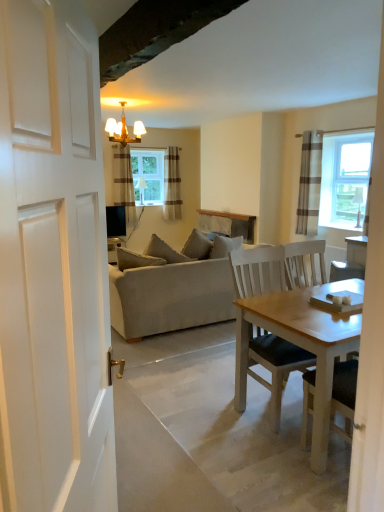
Question: From the image's perspective, would you say gold metallic chandelier at upper center is positioned over striped fabric curtain at center, marked as the 2th curtain in a back-to-front arrangement?

Choices:
 (A) no
 (B) yes

Answer: (B)

Question: Does gold metallic chandelier at upper center come behind striped fabric curtain at center, marked as the 3th curtain in a right-to-left arrangement?

Choices:
 (A) no
 (B) yes

Answer: (A)

Question: Is gold metallic chandelier at upper center positioned with its back to striped fabric curtain at center, the second curtain when ordered from front to back?

Choices:
 (A) yes
 (B) no

Answer: (A)

Question: Does gold metallic chandelier at upper center have a lesser height compared to striped fabric curtain at center, the second curtain when ordered from front to back?

Choices:
 (A) yes
 (B) no

Answer: (A)

Question: Does gold metallic chandelier at upper center turn towards striped fabric curtain at center, marked as the 2th curtain in a back-to-front arrangement?

Choices:
 (A) no
 (B) yes

Answer: (A)

Question: Can you confirm if gold metallic chandelier at upper center is thinner than striped fabric curtain at center, which appears as the first curtain when viewed from the left?

Choices:
 (A) yes
 (B) no

Answer: (B)

Question: Does striped fabric curtain at center, which appears as the first curtain when viewed from the left, have a larger size compared to brown striped curtain at right, positioned as the 3th curtain in left-to-right order?

Choices:
 (A) yes
 (B) no

Answer: (A)

Question: Could you tell me if striped fabric curtain at center, marked as the 3th curtain in a right-to-left arrangement, is turned towards brown striped curtain at right, positioned as the 3th curtain in left-to-right order?

Choices:
 (A) yes
 (B) no

Answer: (B)

Question: Can brown striped curtain at right, which is counted as the third curtain, starting from the back, be found inside striped fabric curtain at center, which appears as the first curtain when viewed from the left?

Choices:
 (A) yes
 (B) no

Answer: (B)

Question: Is striped fabric curtain at center, marked as the 3th curtain in a right-to-left arrangement, behind brown striped curtain at right, which is counted as the third curtain, starting from the back?

Choices:
 (A) yes
 (B) no

Answer: (A)

Question: From the image's perspective, is striped fabric curtain at center, which appears as the first curtain when viewed from the left, on brown striped curtain at right, positioned as the 3th curtain in left-to-right order?

Choices:
 (A) no
 (B) yes

Answer: (B)

Question: Considering the relative sizes of striped fabric curtain at center, the second curtain when ordered from front to back, and brown striped curtain at right, arranged as the first curtain when viewed from the right, in the image provided, is striped fabric curtain at center, the second curtain when ordered from front to back, thinner than brown striped curtain at right, arranged as the first curtain when viewed from the right,?

Choices:
 (A) no
 (B) yes

Answer: (A)

Question: Is there a large distance between striped fabric curtain at center, marked as the 2th curtain in a back-to-front arrangement, and clear glass window at center?

Choices:
 (A) yes
 (B) no

Answer: (B)